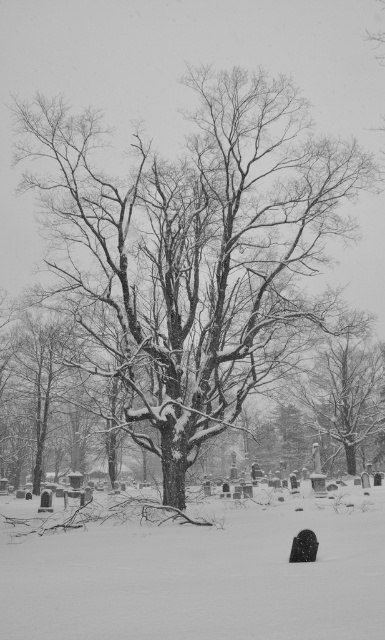
Question: Which of the following is the closest to the observer?

Choices:
 (A) snow-covered bark tree at center
 (B) white powdery snow at center

Answer: (B)

Question: Is snow-covered bark tree at center thinner than white powdery snow at center?

Choices:
 (A) no
 (B) yes

Answer: (B)

Question: Which point is farther from the camera taking this photo?

Choices:
 (A) (353, 150)
 (B) (137, 628)

Answer: (A)

Question: Can you confirm if snow-covered bark tree at center is thinner than white powdery snow at center?

Choices:
 (A) no
 (B) yes

Answer: (B)

Question: Does snow-covered bark tree at center have a greater width compared to white powdery snow at center?

Choices:
 (A) yes
 (B) no

Answer: (B)

Question: Which of the following is the farthest from the observer?

Choices:
 (A) (110, 545)
 (B) (204, 394)

Answer: (B)